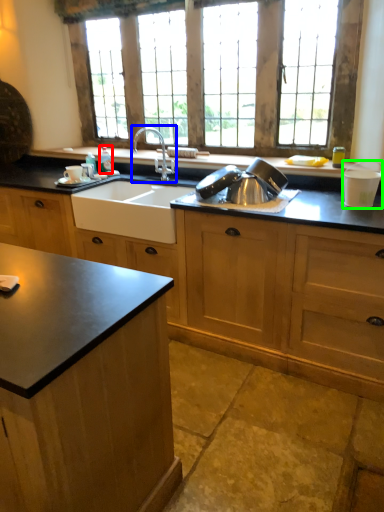
Question: Which object is positioned closest to bottle (highlighted by a red box)? Select from tap (highlighted by a blue box) and appliance (highlighted by a green box).

Choices:
 (A) tap
 (B) appliance

Answer: (A)